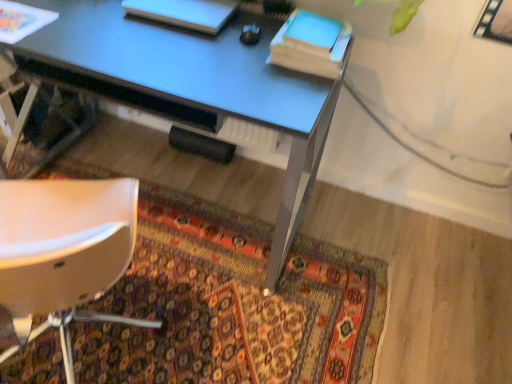
Locate an element on the screen. The height and width of the screenshot is (384, 512). vacant space that is to the left of matte blue book at upper right, which ranks as the 1th book in right-to-left order is located at coordinates (243, 47).